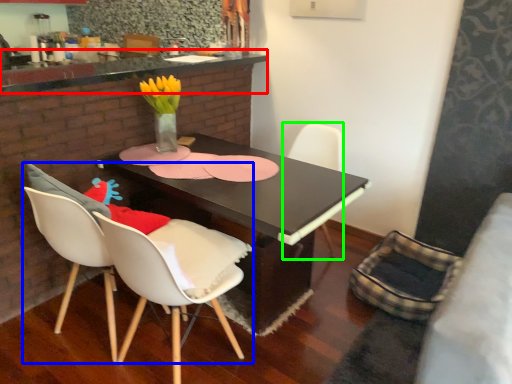
Question: Considering the real-world distances, which object is farthest from counter top (highlighted by a red box)? chair (highlighted by a blue box) or chair (highlighted by a green box)?

Choices:
 (A) chair
 (B) chair

Answer: (B)